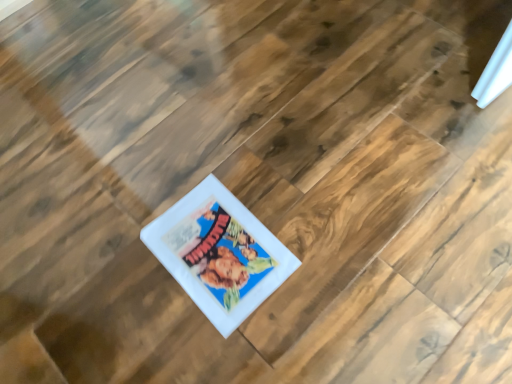
Locate an element on the screen. free spot to the left of white plastic picture frame at center is located at coordinates (110, 273).